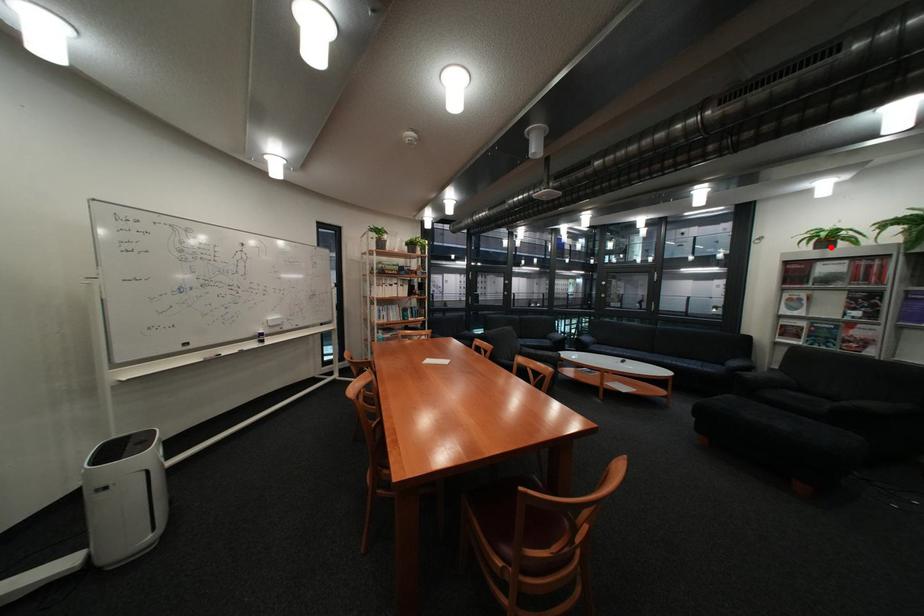
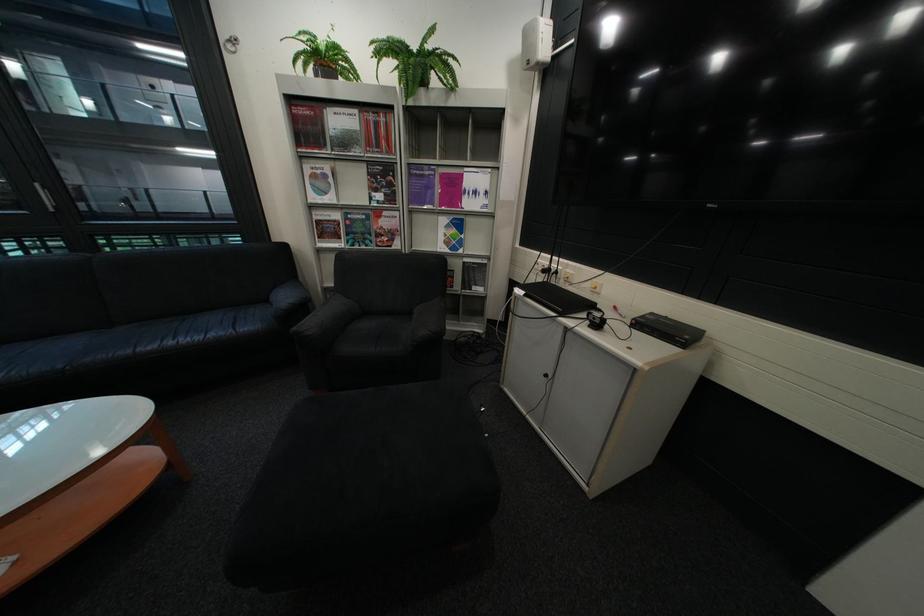
The point at the highlighted location is marked in the first image. Where is the corresponding point in the second image?

(333, 78)